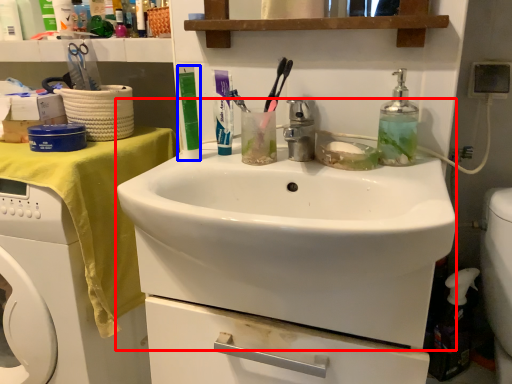
Question: Among these objects, which one is farthest to the camera, sink (highlighted by a red box) or toiletry (highlighted by a blue box)?

Choices:
 (A) sink
 (B) toiletry

Answer: (B)